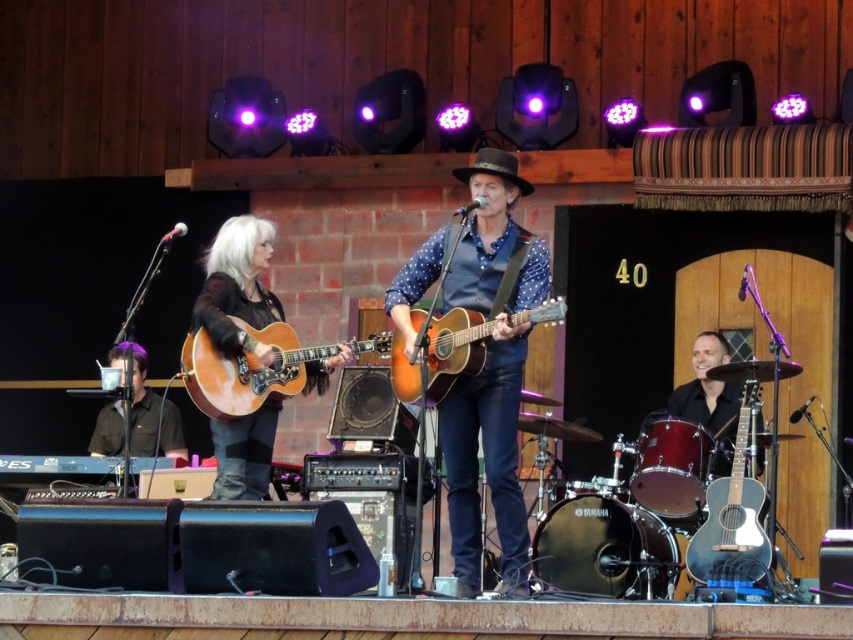
Question: Does matte brown acoustic guitar at center lie in front of light brown acoustic guitar at center?

Choices:
 (A) no
 (B) yes

Answer: (B)

Question: Which is farther from the light brown acoustic guitar at center?

Choices:
 (A) matte blue acoustic guitar at lower right
 (B) acoustic wood guitar at center

Answer: (A)

Question: Is matte brown acoustic guitar at center positioned behind light brown acoustic guitar at center?

Choices:
 (A) yes
 (B) no

Answer: (B)

Question: Which point is farther to the camera?

Choices:
 (A) (476, 534)
 (B) (746, 422)

Answer: (B)

Question: Where is matte brown acoustic guitar at center located in relation to acoustic wood guitar at center in the image?

Choices:
 (A) left
 (B) right

Answer: (B)

Question: Which point appears closest to the camera in this image?

Choices:
 (A) (740, 410)
 (B) (213, 397)
 (C) (517, 280)
 (D) (485, 339)

Answer: (D)